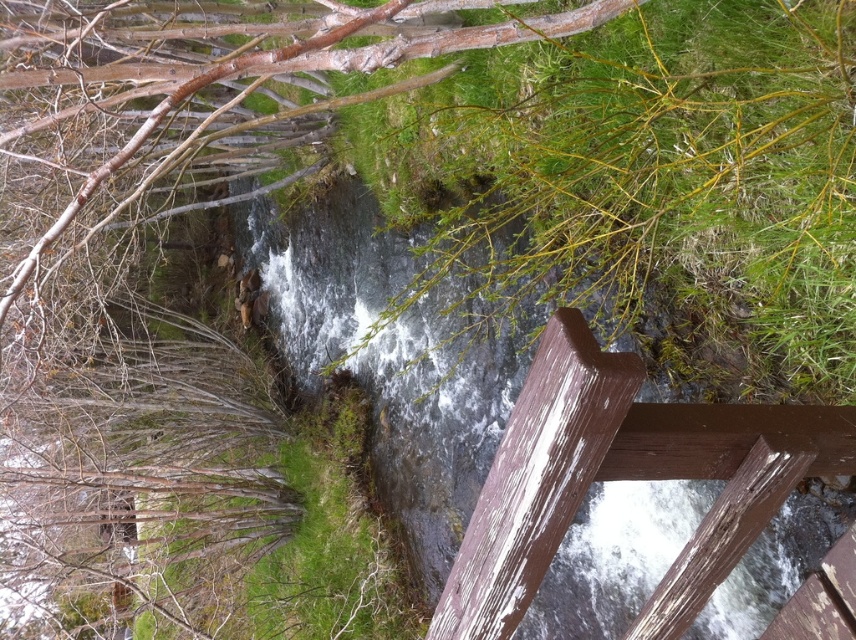
You are standing on a wooden structure overlooking a stream. You notice two objects in the scene described in the image. One is the white painted wood at center and the other is the smooth bark tree at upper left. Which of these two objects is located to the right of the other?

The white painted wood at center is positioned on the right side of the smooth bark tree at upper left.

You are standing on the wooden structure looking at the clear water at center and the smooth bark tree at upper left. Which object is closer to you?

The clear water at center is closer to you than the smooth bark tree at upper left because it is further to the viewer.